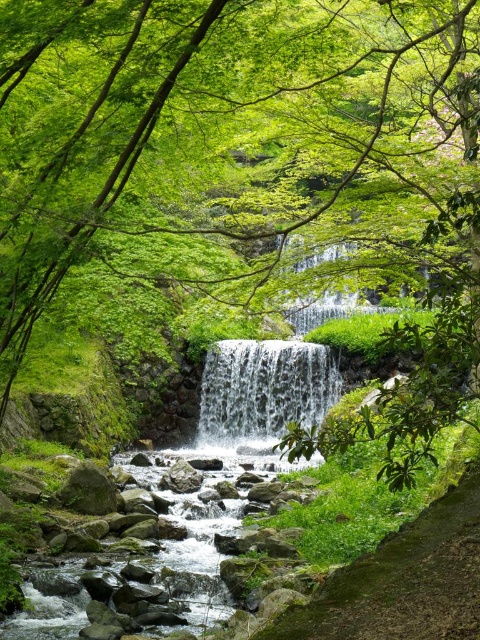
You are standing at the edge of the rocky stream bed and want to cross to the other side. You see the green mossy rocks at center and the clear water at center. Which object should you step on first to start your crossing?

You should step on the green mossy rocks at center first because they are positioned to the left of the clear water at center, making them the closest to your starting position on the edge of the stream bed.

You are standing at the origin point of the scene. Which direction should you move to reach the green mossy rocks at center?

The green mossy rocks at center are located at point 0.836 in the x direction and 0.433 in the y direction. Since you are at the origin, you should move towards the right and slightly upwards to reach them.